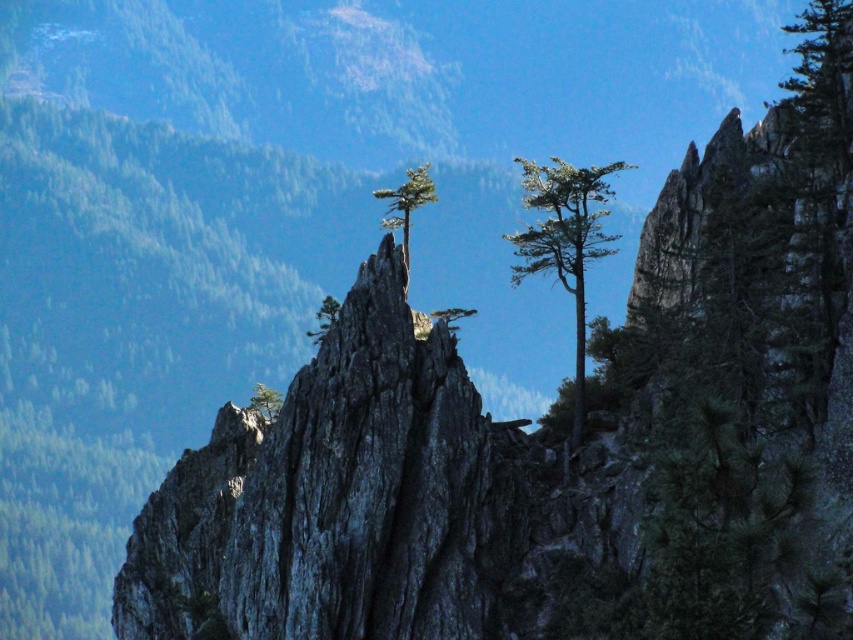
Which is in front, point (585, 260) or point (405, 224)?

Point (585, 260) is more forward.

Does green needle-like tree at center-right come in front of green textured tree at center?

No, green needle-like tree at center-right is further to the viewer.

What do you see at coordinates (566, 241) in the screenshot? I see `green needle-like tree at center-right` at bounding box center [566, 241].

Image resolution: width=853 pixels, height=640 pixels. I want to click on green needle-like tree at center-right, so click(x=566, y=241).